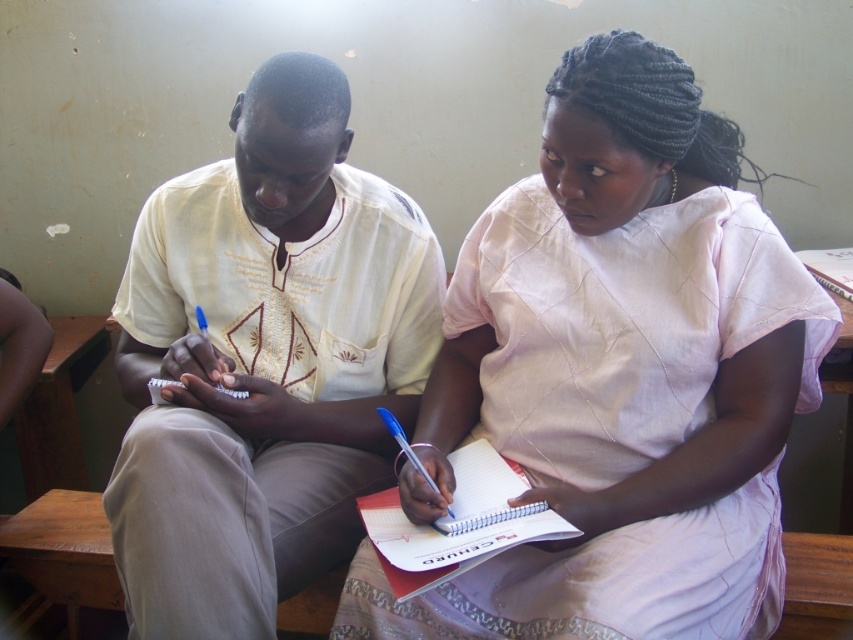
Question: Can you confirm if light beige embroidered shirt at center is positioned above white spiral notebook at center?

Choices:
 (A) yes
 (B) no

Answer: (A)

Question: Where is light pink fabric dress at center located in relation to white spiral notebook at center in the image?

Choices:
 (A) right
 (B) left

Answer: (A)

Question: Which point is farther to the camera?

Choices:
 (A) (410, 536)
 (B) (142, 467)

Answer: (A)

Question: Among these points, which one is farthest from the camera?

Choices:
 (A) (413, 458)
 (B) (346, 520)

Answer: (B)

Question: Which object appears farthest from the camera in this image?

Choices:
 (A) light beige embroidered shirt at center
 (B) light pink fabric dress at center
 (C) white spiral notebook at center

Answer: (C)

Question: Can you confirm if light pink fabric dress at center is positioned above white spiral notebook at center?

Choices:
 (A) no
 (B) yes

Answer: (B)